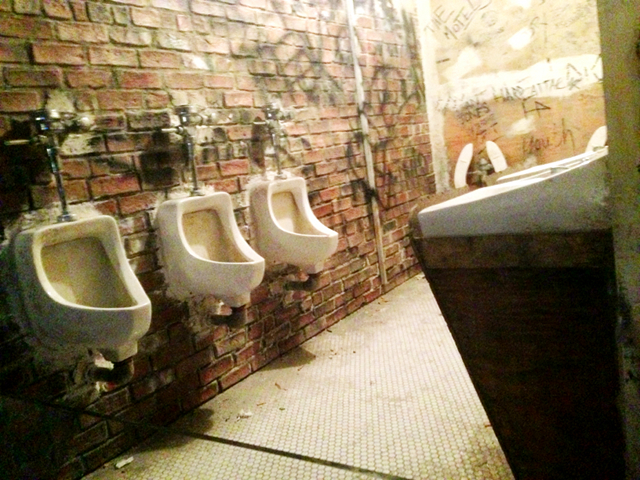
Identify the location of toilet seats. This screenshot has height=480, width=640. (496, 158), (595, 137).